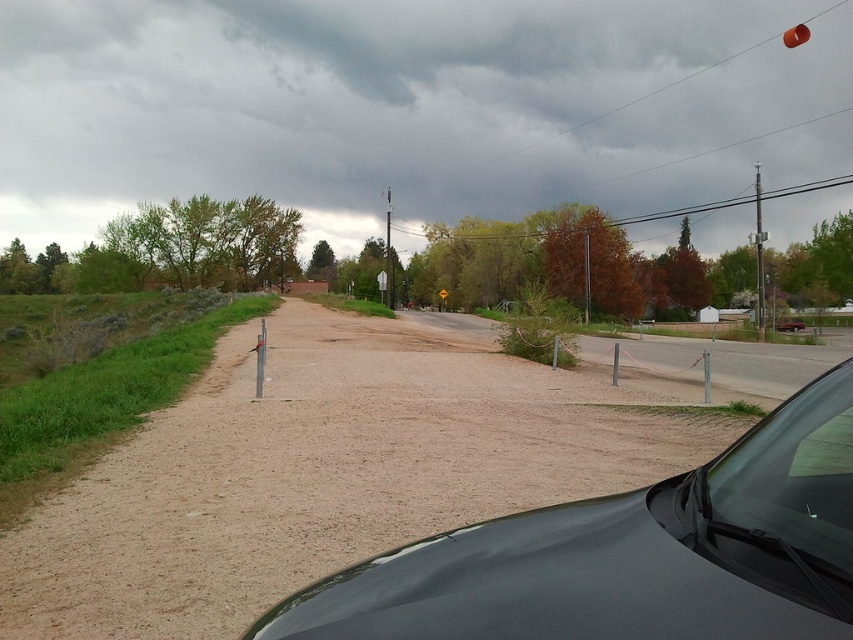
You are a delivery driver who needs to park your black glossy car at lower right. The parking spot has a width limit of 1.8 meters. Can you safely park your car without damaging the transparent glass windshield at lower right?

The black glossy car at lower right is wider than the transparent glass windshield at lower right. Since the car is wider, it may exceed the parking spot width limit of 1.8 meters, so there is a risk of damaging the windshield. Check the car dimensions before parking.

You are a pedestrian standing on the dirt road and want to cross to the paved road. The black glossy car at lower right and the transparent glass windshield at lower right are in your path. Which object will you encounter first?

The transparent glass windshield at lower right is closer to you than the black glossy car at lower right, so you will encounter the transparent glass windshield at lower right first.